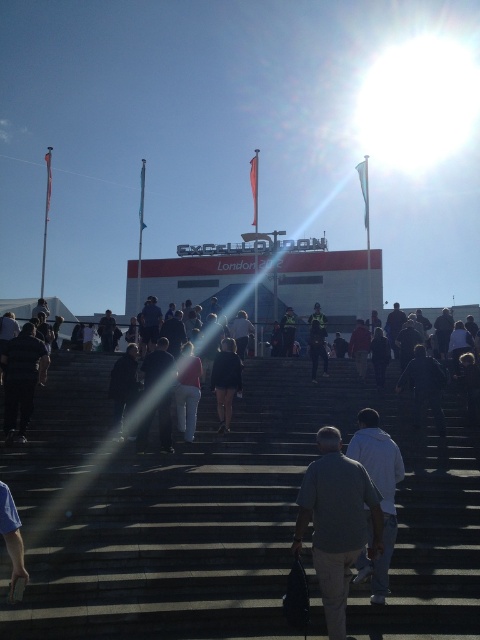
Can you confirm if gray fabric shirt at center is wider than dark blue jeans at center?

Yes, gray fabric shirt at center is wider than dark blue jeans at center.

Is gray fabric shirt at center positioned behind dark blue jeans at center?

No, gray fabric shirt at center is in front of dark blue jeans at center.

Describe the element at coordinates (336, 522) in the screenshot. I see `gray fabric shirt at center` at that location.

I want to click on gray fabric shirt at center, so click(336, 522).

Who is taller, dark blue jeans at center or matte red shirt at center?

dark blue jeans at center is taller.

I want to click on dark blue jeans at center, so click(226, 381).

You are a GUI agent. You are given a task and a screenshot of the screen. Output one action in this format:
    pyautogui.click(x=<x>, y=<y>)
    Task: Click on the dark blue jeans at center
    This screenshot has height=640, width=480.
    Given the screenshot: What is the action you would take?
    pyautogui.click(x=226, y=381)

Is dark gray concrete stairs at center above matte red shirt at center?

Actually, dark gray concrete stairs at center is below matte red shirt at center.

Identify the location of dark gray concrete stairs at center. (226, 515).

Image resolution: width=480 pixels, height=640 pixels. In order to click on dark gray concrete stairs at center in this screenshot , I will do `click(226, 515)`.